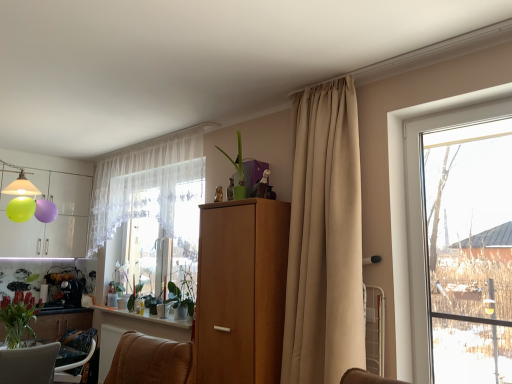
Question: Would you say green matte plant at lower center, acting as the first plant starting from the front, is part of green glossy plant at center, which ranks as the first plant in back-to-front order,'s contents?

Choices:
 (A) yes
 (B) no

Answer: (B)

Question: From the image's perspective, is green glossy plant at center, positioned as the 1th plant in left-to-right order, located above green matte plant at lower center, acting as the first plant starting from the front?

Choices:
 (A) yes
 (B) no

Answer: (B)

Question: Considering the relative positions of green glossy plant at center, positioned as the 1th plant in left-to-right order, and green matte plant at lower center, acting as the first plant starting from the front, in the image provided, is green glossy plant at center, positioned as the 1th plant in left-to-right order, to the left of green matte plant at lower center, acting as the first plant starting from the front, from the viewer's perspective?

Choices:
 (A) no
 (B) yes

Answer: (B)

Question: Can you confirm if green glossy plant at center, which ranks as the first plant in back-to-front order, is bigger than green matte plant at lower center, the second plant from the left?

Choices:
 (A) yes
 (B) no

Answer: (B)

Question: Considering the relative sizes of green glossy plant at center, which ranks as the 2th plant in front-to-back order, and green matte plant at lower center, acting as the first plant starting from the front, in the image provided, is green glossy plant at center, which ranks as the 2th plant in front-to-back order, thinner than green matte plant at lower center, acting as the first plant starting from the front,?

Choices:
 (A) yes
 (B) no

Answer: (A)

Question: Does green glossy plant at center, which ranks as the 2th plant in front-to-back order, have a smaller size compared to green matte plant at lower center, the second plant positioned from the back?

Choices:
 (A) yes
 (B) no

Answer: (A)

Question: Considering the relative sizes of green matte vase at lower left and green glossy plant at center, which ranks as the first plant in back-to-front order, in the image provided, is green matte vase at lower left bigger than green glossy plant at center, which ranks as the first plant in back-to-front order,?

Choices:
 (A) no
 (B) yes

Answer: (B)

Question: Is green matte vase at lower left wider than green glossy plant at center, the second plant from the right?

Choices:
 (A) yes
 (B) no

Answer: (A)

Question: From the image's perspective, is green matte vase at lower left below green glossy plant at center, which ranks as the 2th plant in front-to-back order?

Choices:
 (A) yes
 (B) no

Answer: (B)

Question: Does green matte vase at lower left have a lesser height compared to green glossy plant at center, positioned as the 1th plant in left-to-right order?

Choices:
 (A) no
 (B) yes

Answer: (A)

Question: Is green matte vase at lower left surrounding green glossy plant at center, positioned as the 1th plant in left-to-right order?

Choices:
 (A) no
 (B) yes

Answer: (A)

Question: Does green matte vase at lower left lie in front of green glossy plant at center, positioned as the 1th plant in left-to-right order?

Choices:
 (A) no
 (B) yes

Answer: (B)

Question: Is green matte vase at lower left oriented away from brown leather armchair at lower center, the 2th furniture positioned from the front?

Choices:
 (A) yes
 (B) no

Answer: (A)